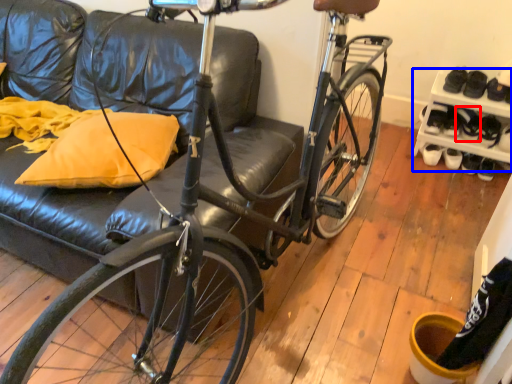
Question: Which of the following is the closest to the observer, shoe (highlighted by a red box) or shelf (highlighted by a blue box)?

Choices:
 (A) shoe
 (B) shelf

Answer: (B)